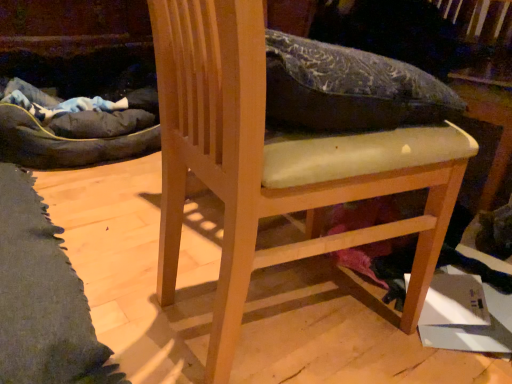
At what (x,y) coordinates should I click in order to perform the action: click on vacant space that is to the left of light wood chair at center. Please return your answer as a coordinate pair (x, y). The height and width of the screenshot is (384, 512). Looking at the image, I should click on (133, 278).